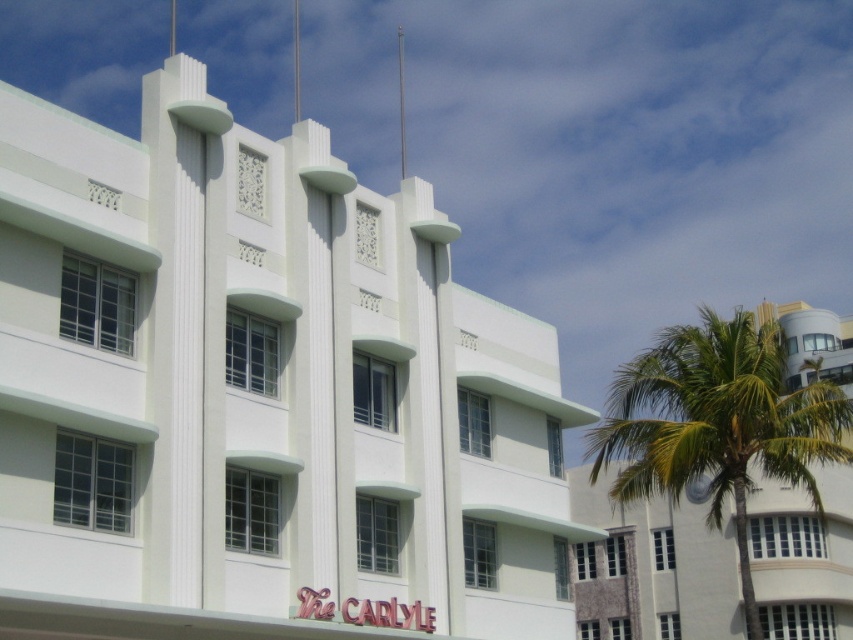
Question: Can you confirm if white smooth building at center is positioned to the left of green leafy palm tree at right?

Choices:
 (A) yes
 (B) no

Answer: (A)

Question: Which point appears closest to the camera in this image?

Choices:
 (A) tap(657, 376)
 (B) tap(183, 252)

Answer: (B)

Question: Which point is farther to the camera?

Choices:
 (A) (660, 449)
 (B) (199, 365)

Answer: (A)

Question: Observing the image, what is the correct spatial positioning of white smooth building at center in reference to green leafy palm tree at right?

Choices:
 (A) below
 (B) above

Answer: (B)

Question: Is white smooth building at center wider than green leafy palm tree at right?

Choices:
 (A) no
 (B) yes

Answer: (A)